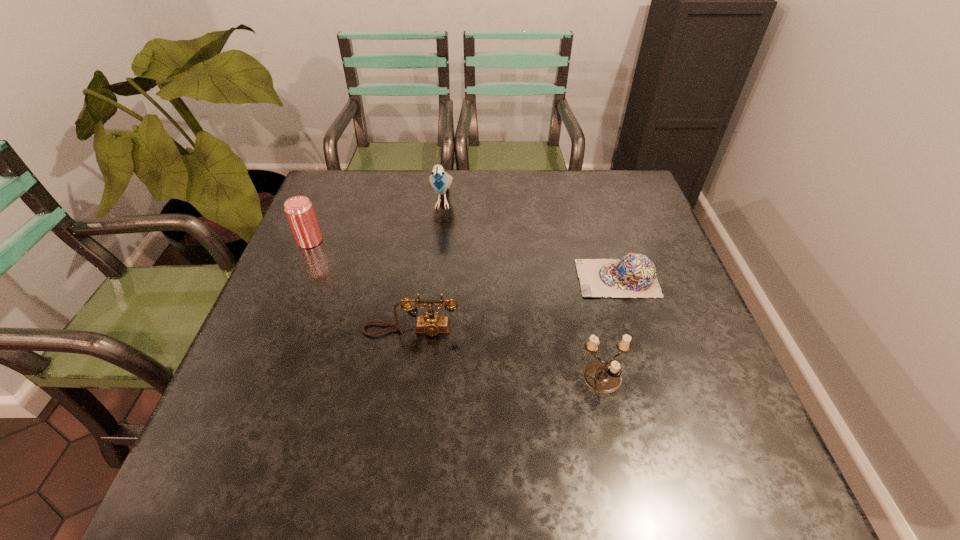
Identify the location of vacant space situated on the right of the candle holder. The width and height of the screenshot is (960, 540). (665, 380).

Find the location of a particular element. The width and height of the screenshot is (960, 540). vacant space situated on the front-facing side of the telephone is located at coordinates (403, 387).

Locate an element on the screen. The width and height of the screenshot is (960, 540). free space located on the front, side, and top of the cap is located at coordinates (478, 279).

At what (x,y) coordinates should I click in order to perform the action: click on free space located 0.050m on the front, side, and top of the cap. Please return your answer as a coordinate pair (x, y). Looking at the image, I should click on (558, 279).

Locate an element on the screen. The image size is (960, 540). vacant space located 0.150m on the front, side, and top of the cap is located at coordinates (517, 279).

The image size is (960, 540). In order to click on object that is at the far edge in this screenshot , I will do `click(441, 181)`.

You are a GUI agent. You are given a task and a screenshot of the screen. Output one action in this format:
    pyautogui.click(x=<x>, y=<y>)
    Task: Click on the object located at the left edge
    
    Given the screenshot: What is the action you would take?
    pyautogui.click(x=299, y=210)

Where is `object situated at the right edge`? This screenshot has height=540, width=960. object situated at the right edge is located at coordinates (634, 275).

In the image, there is a desktop. At what (x,y) coordinates should I click in order to perform the action: click on blank space at the far edge. Please return your answer as a coordinate pair (x, y). The height and width of the screenshot is (540, 960). Looking at the image, I should click on (373, 202).

Find the location of a particular element. vacant area at the near edge of the desktop is located at coordinates (371, 455).